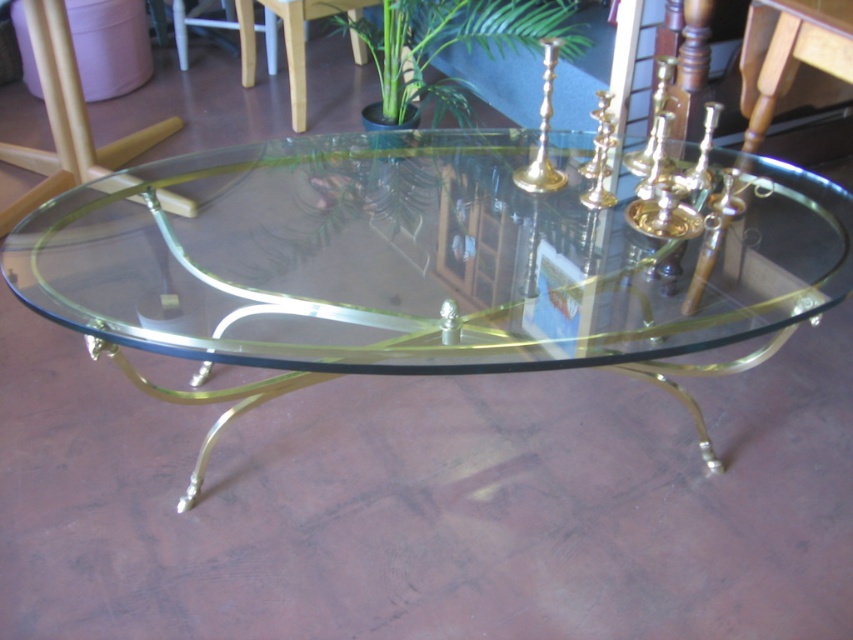
You are arranging a small decorative item on the transparent glass table at center. You want to place the green leafy plant at upper center in a way that it doesn not block the view of the table. Where should you position it?

Since the transparent glass table at center is larger than the green leafy plant at upper center, placing the green leafy plant at upper center towards the edge of the table would allow most of the table surface to remain visible and unobstructed.

You are standing in front of the coffee table and notice two points marked on its surface. The first point is at coordinates point (397, 236) and the second is at point (444, 0). Which point is closer to you?

Point (397, 236) is closer to the camera than point (444, 0), so the first point is closer to you.

You are arranging a party and need to place a decorative item on the transparent glass table at center. The green leafy plant at upper center is already there. Can the plant fit entirely on the table?

The transparent glass table at center has a larger width than the green leafy plant at upper center, so the plant can fit entirely on the table.